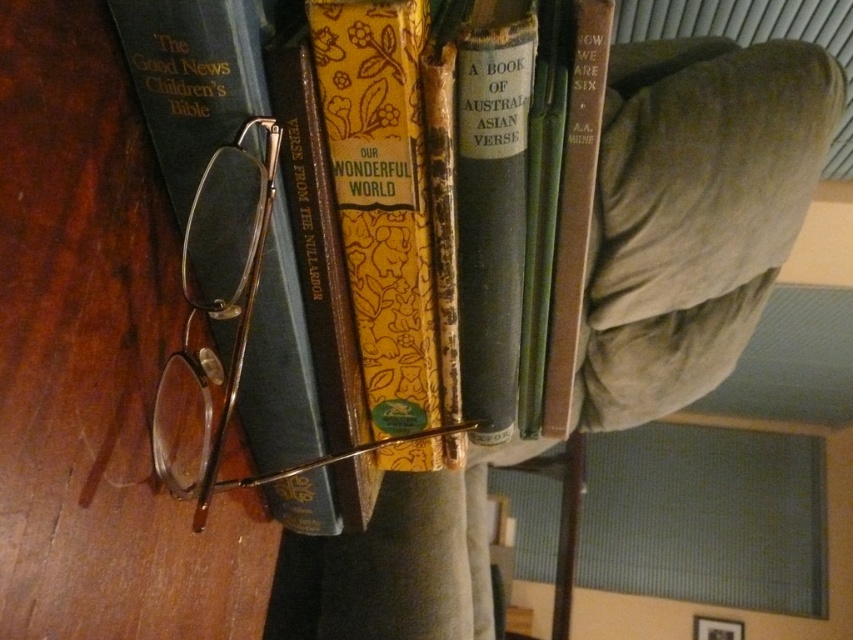
Question: Observing the image, what is the correct spatial positioning of hardcover book at left in reference to brown leather book at center?

Choices:
 (A) left
 (B) right

Answer: (A)

Question: Can you confirm if yellow paper-covered book at center is positioned to the right of brown leather book at center?

Choices:
 (A) no
 (B) yes

Answer: (A)

Question: Does yellow paper-covered book at center lie in front of hardcover book at left?

Choices:
 (A) no
 (B) yes

Answer: (A)

Question: Which of the following is the farthest from the observer?

Choices:
 (A) (555, 392)
 (B) (189, 49)
 (C) (335, 54)

Answer: (A)

Question: Based on their relative distances, which object is farther from the hardcover book at left?

Choices:
 (A) brown leather book at center
 (B) yellow paper-covered book at center

Answer: (A)

Question: Which of the following is the closest to the observer?

Choices:
 (A) (328, 476)
 (B) (550, 333)

Answer: (B)